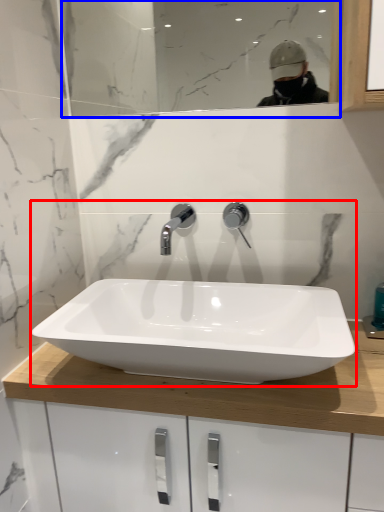
Question: Among these objects, which one is farthest to the camera, sink (highlighted by a red box) or mirror (highlighted by a blue box)?

Choices:
 (A) sink
 (B) mirror

Answer: (B)